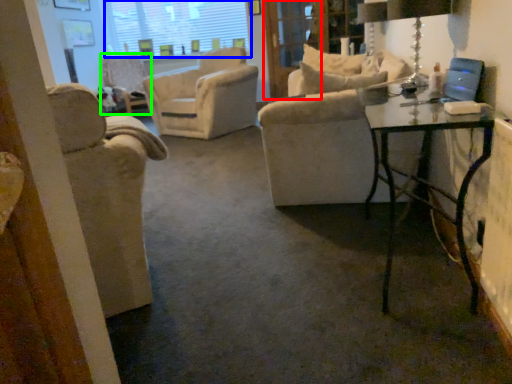
Question: Which object is positioned closest to screen door (highlighted by a red box)? Select from window screen (highlighted by a blue box) and chair (highlighted by a green box).

Choices:
 (A) window screen
 (B) chair

Answer: (B)